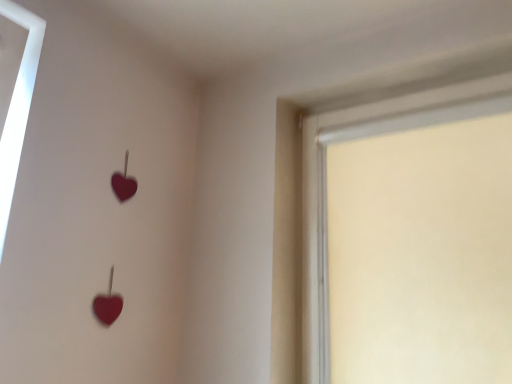
Measure the distance between point (309, 128) and camera.

A distance of 5.02 feet exists between point (309, 128) and camera.

The width and height of the screenshot is (512, 384). Find the location of `white matte window at upper right`. white matte window at upper right is located at coordinates (325, 179).

What do you see at coordinates (325, 179) in the screenshot?
I see `white matte window at upper right` at bounding box center [325, 179].

Identify the location of white matte window at upper right. The width and height of the screenshot is (512, 384). (325, 179).